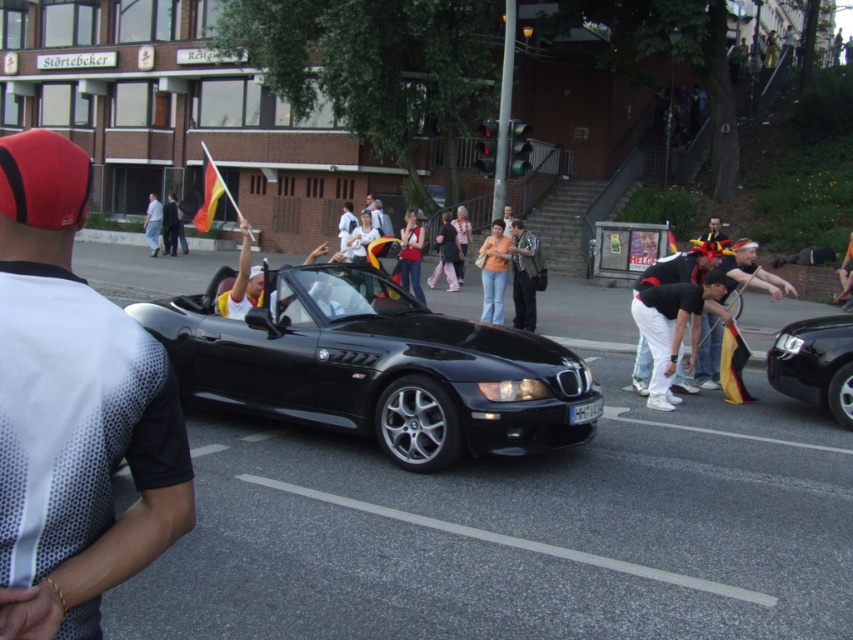
Is white mesh shirt at left closer to camera compared to matte red tank top at center?

Yes, white mesh shirt at left is closer to the viewer.

Can you confirm if white mesh shirt at left is positioned to the right of matte red tank top at center?

In fact, white mesh shirt at left is to the left of matte red tank top at center.

Which is behind, point (80, 417) or point (401, 228)?

The point (401, 228) is behind.

Locate an element on the screen. The width and height of the screenshot is (853, 640). white mesh shirt at left is located at coordinates (73, 410).

In the scene shown: Who is taller, white cotton pants at center or matte orange shirt at center?

matte orange shirt at center

Is point (720, 250) farther from viewer compared to point (505, 240)?

No, (720, 250) is in front of (505, 240).

You are a GUI agent. You are given a task and a screenshot of the screen. Output one action in this format:
    pyautogui.click(x=<x>, y=<y>)
    Task: Click on the white cotton pants at center
    The width and height of the screenshot is (853, 640).
    Given the screenshot: What is the action you would take?
    pyautogui.click(x=682, y=266)

Is yellow-red-yellow fabric flag at upper left below white cotton shirt at center?

Indeed, yellow-red-yellow fabric flag at upper left is positioned under white cotton shirt at center.

Is the position of yellow-red-yellow fabric flag at upper left more distant than that of white cotton shirt at center?

No, yellow-red-yellow fabric flag at upper left is in front of white cotton shirt at center.

Between point (213, 193) and point (152, 244), which one is positioned in front?

Positioned in front is point (213, 193).

Identify the location of yellow-red-yellow fabric flag at upper left. (209, 193).